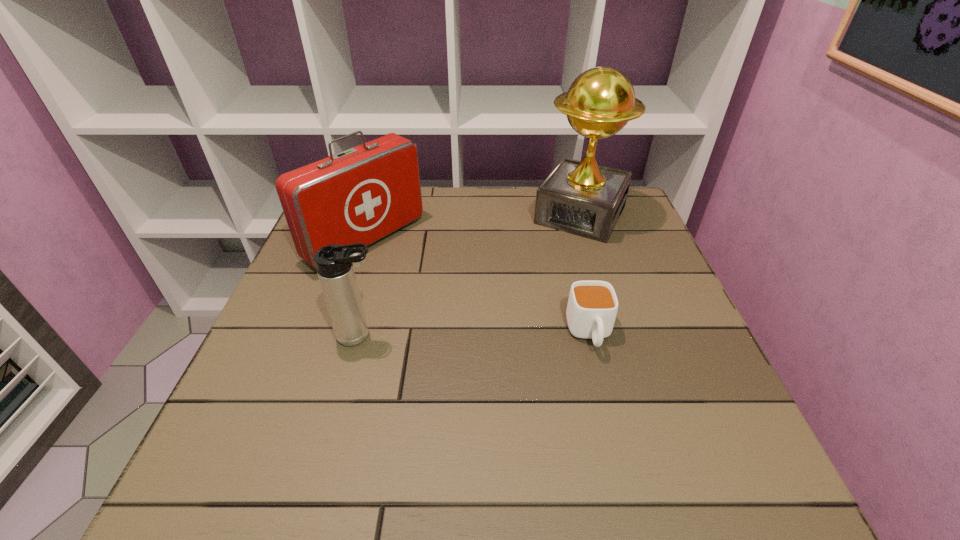
Where is `thermos bottle`? thermos bottle is located at coordinates pos(334,263).

Find the location of `cup`. cup is located at coordinates (592, 307).

Where is `award`? The image size is (960, 540). award is located at coordinates (583, 198).

The height and width of the screenshot is (540, 960). Find the location of `the first-aid kit`. the first-aid kit is located at coordinates (360, 195).

Locate an element on the screen. free space located on the handle side of the third tallest object is located at coordinates (521, 335).

Locate an element on the screen. This screenshot has height=540, width=960. blank space located 0.080m on the side with the handle of the cup is located at coordinates (605, 395).

The image size is (960, 540). In order to click on vacant space located 0.060m on the front-facing side of the award in this screenshot , I will do `click(557, 253)`.

Identify the location of free location located on the front-facing side of the award. (522, 310).

Identify the location of free space located 0.290m on the front-facing side of the award. (522, 310).

Identify the location of vacant space located on the side of the second tallest object with the first aid cross symbol. (530, 351).